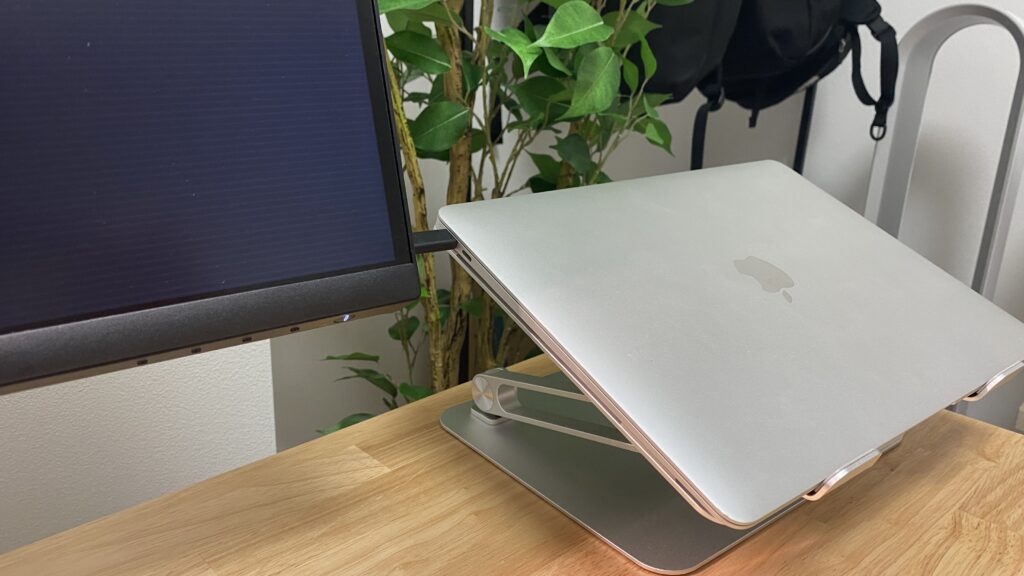
The image size is (1024, 576). I want to click on laptop computer, so click(x=571, y=314).